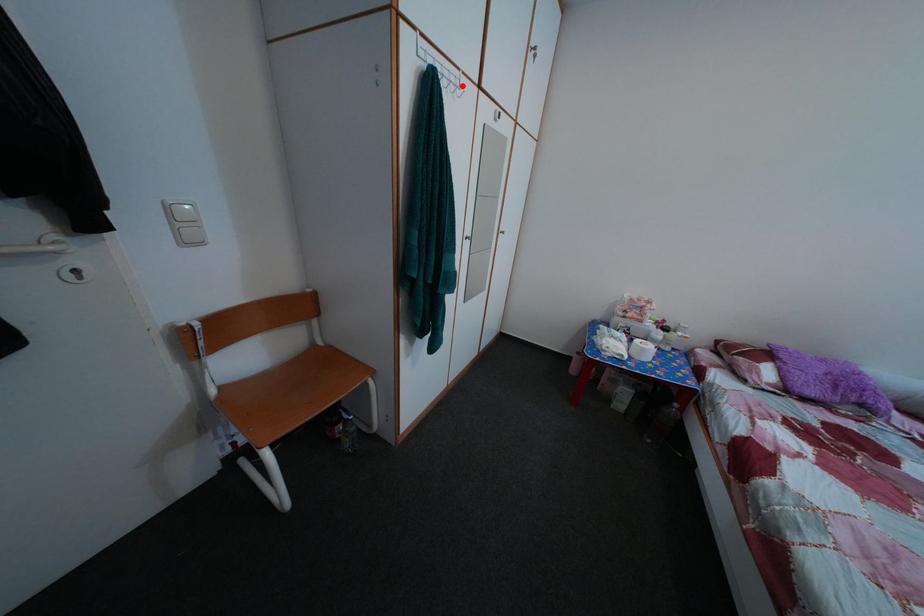
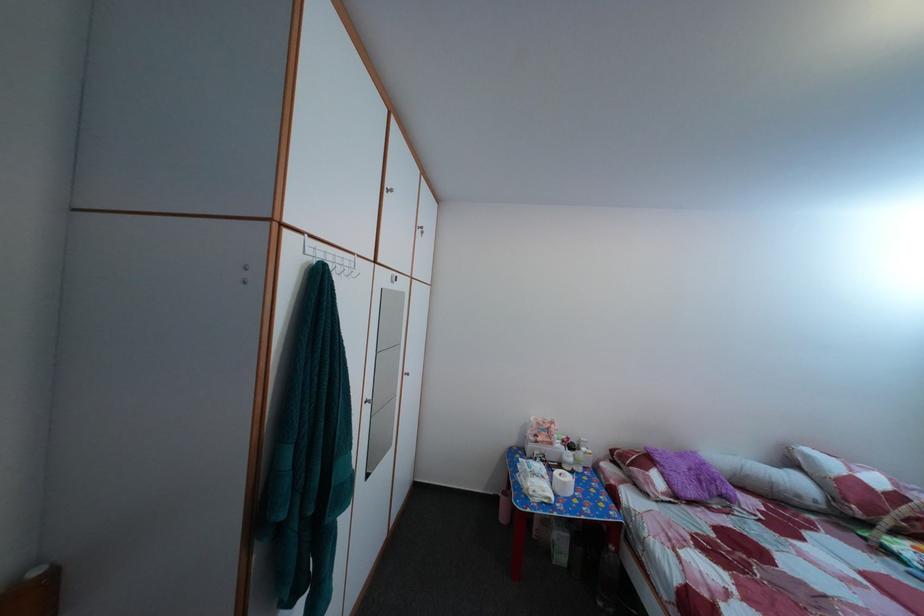
Find the pixel in the second image that matches the highlighted location in the first image.

(356, 270)